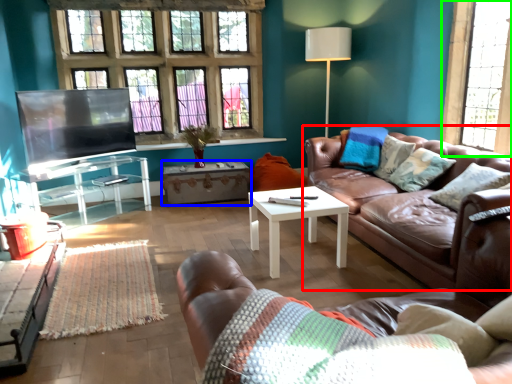
Question: Estimate the real-world distances between objects in this image. Which object is closer to studio couch (highlighted by a red box), table (highlighted by a blue box) or window (highlighted by a green box)?

Choices:
 (A) table
 (B) window

Answer: (B)